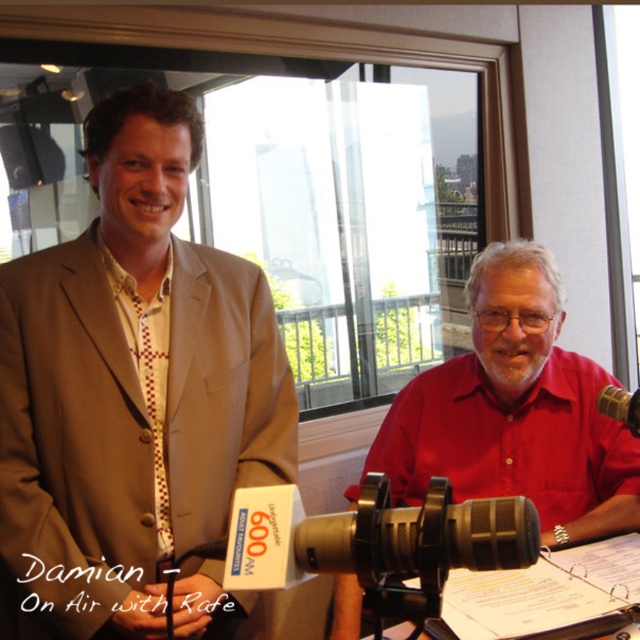
Consider the image. You are a guest speaker who needs to sit between the two hosts. The host in the matte beige suit at center is on your left, and the host in the red matte shirt at center is on your right. Can you sit in the middle without overlapping either of them?

The matte beige suit at center is positioned over the red matte shirt at center, so sitting between them would require moving one of the hosts since they are layered on top of each other, making it impossible to sit in between without overlapping.

You are a guest speaker at a radio show and need to adjust your seating so that your matte beige suit at center is visible to the camera. The black matte microphone at lower center is in the way. Can you move the microphone to the side without moving your seat?

The matte beige suit at center has a larger size compared to the black matte microphone at lower center. Since the microphone is smaller, you can move it to the side to make space while staying seated.